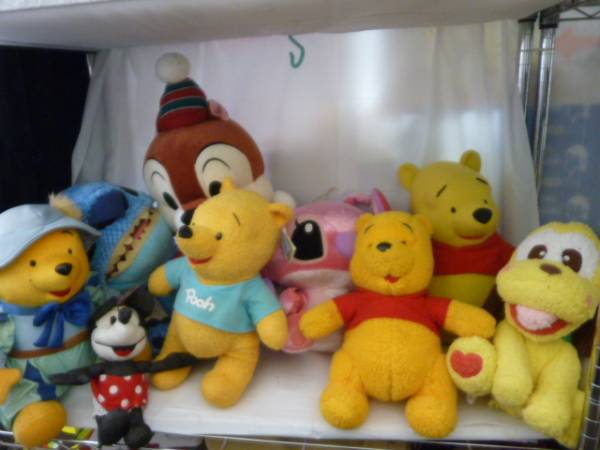
Find the location of a particular element. The image size is (600, 450). stuffed toys is located at coordinates (36, 283), (131, 247), (124, 347), (203, 298), (200, 158), (325, 263), (371, 315), (464, 199), (559, 307).